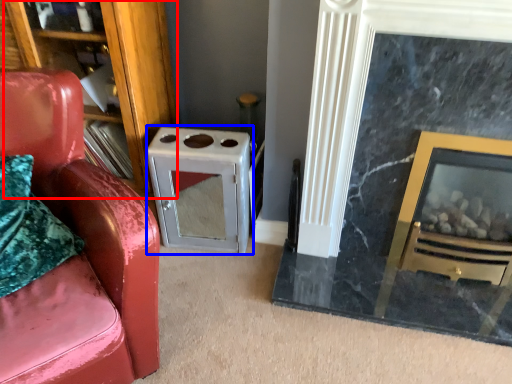
Question: Which object is closer to the camera taking this photo, bookshelf (highlighted by a red box) or appliance (highlighted by a blue box)?

Choices:
 (A) bookshelf
 (B) appliance

Answer: (A)